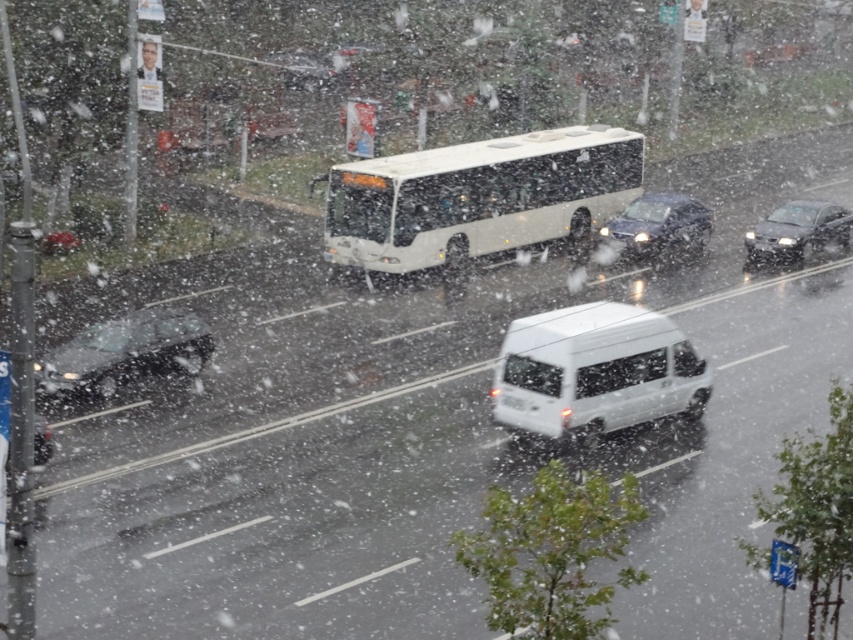
You are a delivery person trying to park your vehicle in a tight space between the glossy black car at lower left and the sleek black sedan at center. Which vehicle do you need to be more cautious about in terms of height clearance?

The sleek black sedan at center is taller than the glossy black car at lower left, so you need to be more cautious about the sleek black sedan at center to ensure sufficient height clearance.

You are standing on the snowy street and want to walk from point A to point B. Point A is at coordinates point [141,314] and point B is at coordinates point [798,250]. Which point is closer to you when you start walking?

Point [141,314] is closer to the viewer than point [798,250], so you will start at the closer point and walk towards the farther one.